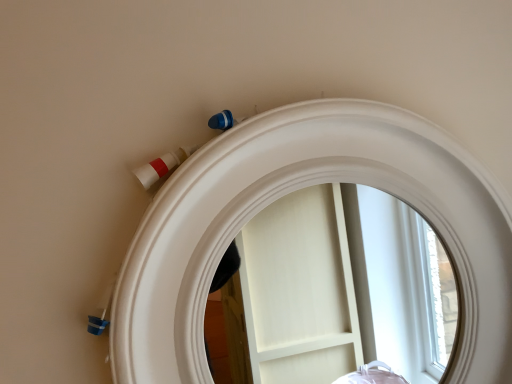
Where is `white glossy mirror at upper center`? white glossy mirror at upper center is located at coordinates (295, 190).

Describe the element at coordinates (295, 190) in the screenshot. I see `white glossy mirror at upper center` at that location.

What are the coordinates of `white glossy mirror at upper center` in the screenshot? It's located at (295, 190).